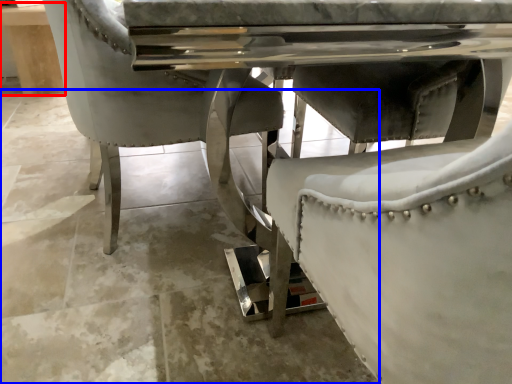
Question: Which object is further to the camera taking this photo, table (highlighted by a red box) or concrete (highlighted by a blue box)?

Choices:
 (A) table
 (B) concrete

Answer: (A)